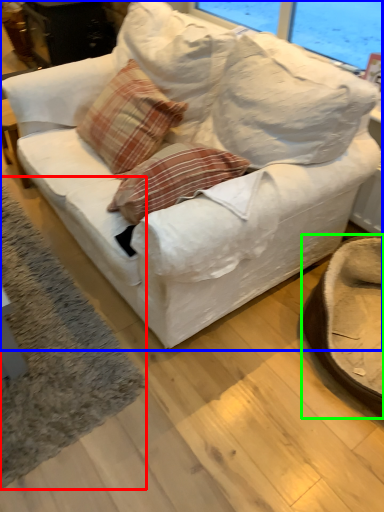
Question: Which is nearer to the mat (highlighted by a red box)? studio couch (highlighted by a blue box) or swivel chair (highlighted by a green box).

Choices:
 (A) studio couch
 (B) swivel chair

Answer: (A)